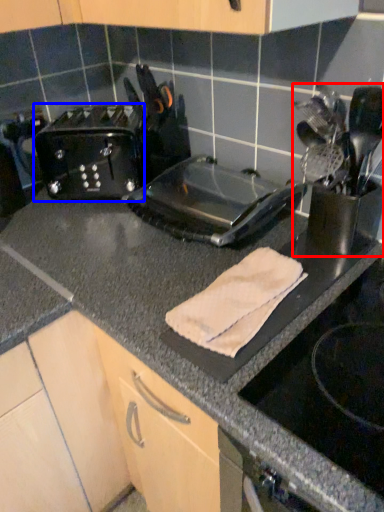
Question: Among these objects, which one is nearest to the camera, appliance (highlighted by a red box) or toaster (highlighted by a blue box)?

Choices:
 (A) appliance
 (B) toaster

Answer: (A)